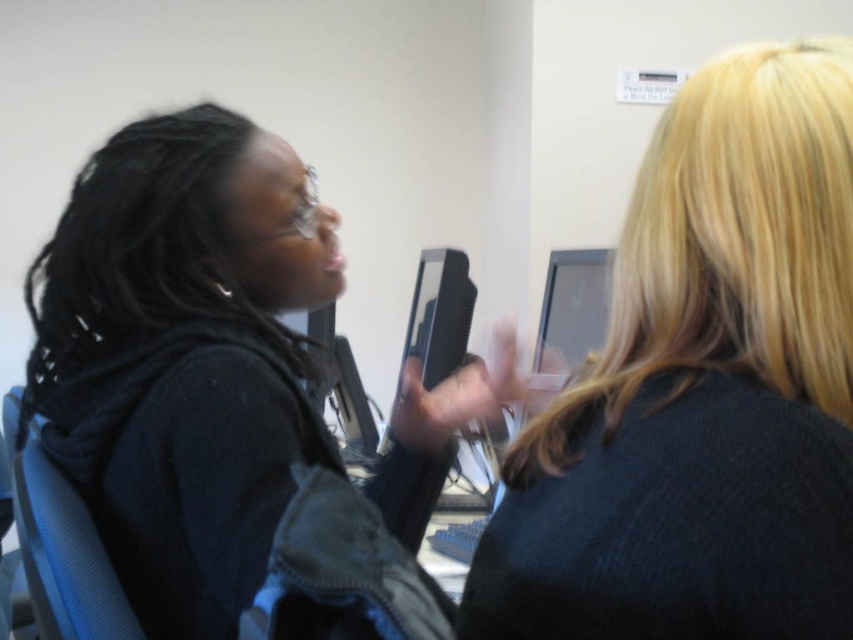
You are standing in the office and want to hand a document to the person with the blonde hair at upper right. The matte black monitor at center is blocking your path. Can you walk around the monitor to reach them?

The blonde hair at upper right is closer to the viewer than the matte black monitor at center, so you can walk around the monitor to reach the person since they are in front of it.

You are standing at the entrance of the room and want to locate the black matte jacket at center. According to the coordinates given, in which direction should you move from your current position to reach it?

The black matte jacket at center is located at coordinates point (183, 355). Since you are at the entrance, you should move towards the center of the room to reach it.

You are a security camera positioned at the entrance of the room. You need to determine if the blonde hair at upper right is within your 16 inch detection range. Can you confirm?

The distance of blonde hair at upper right from viewer is 15.46 inches, which is within the 16 inch detection range, so yes, the blonde hair at upper right is within range.